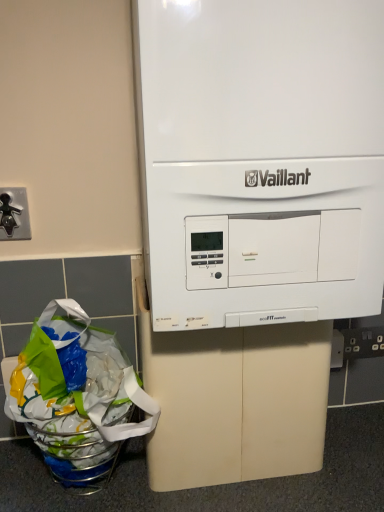
Question: Would you say black metal faucet at left is part of translucent plastic grocery bag at lower left's contents?

Choices:
 (A) no
 (B) yes

Answer: (A)

Question: Does translucent plastic grocery bag at lower left have a larger size compared to black metal faucet at left?

Choices:
 (A) yes
 (B) no

Answer: (A)

Question: From a real-world perspective, is translucent plastic grocery bag at lower left located higher than black metal faucet at left?

Choices:
 (A) no
 (B) yes

Answer: (A)

Question: Considering the relative sizes of translucent plastic grocery bag at lower left and black metal faucet at left in the image provided, is translucent plastic grocery bag at lower left taller than black metal faucet at left?

Choices:
 (A) yes
 (B) no

Answer: (A)

Question: Can we say translucent plastic grocery bag at lower left lies outside black metal faucet at left?

Choices:
 (A) no
 (B) yes

Answer: (B)

Question: From the image's perspective, is translucent plastic grocery bag at lower left below black metal faucet at left?

Choices:
 (A) no
 (B) yes

Answer: (B)

Question: Is translucent plastic grocery bag at lower left to the left of white matte vaillant boiler at center from the viewer's perspective?

Choices:
 (A) yes
 (B) no

Answer: (A)

Question: From the image's perspective, is translucent plastic grocery bag at lower left over white matte vaillant boiler at center?

Choices:
 (A) yes
 (B) no

Answer: (B)

Question: From the image's perspective, is translucent plastic grocery bag at lower left under white matte vaillant boiler at center?

Choices:
 (A) no
 (B) yes

Answer: (B)

Question: Is the depth of translucent plastic grocery bag at lower left less than that of white matte vaillant boiler at center?

Choices:
 (A) no
 (B) yes

Answer: (A)

Question: Would you say translucent plastic grocery bag at lower left is outside white matte vaillant boiler at center?

Choices:
 (A) no
 (B) yes

Answer: (B)

Question: Is translucent plastic grocery bag at lower left further to camera compared to white matte vaillant boiler at center?

Choices:
 (A) no
 (B) yes

Answer: (B)

Question: Is white matte vaillant boiler at center positioned with its back to translucent plastic grocery bag at lower left?

Choices:
 (A) yes
 (B) no

Answer: (B)